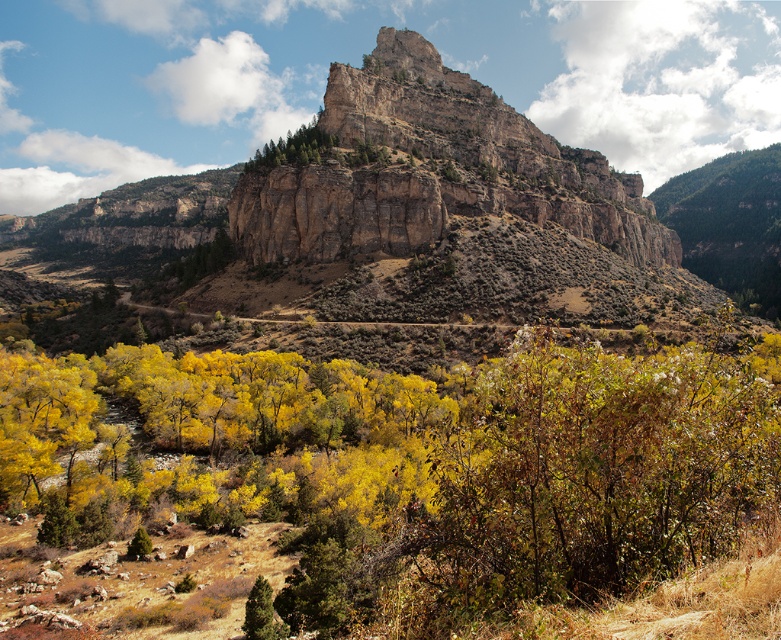
Can you confirm if yellow leafy tree at center is positioned above rugged stone mountain at center?

Incorrect, yellow leafy tree at center is not positioned above rugged stone mountain at center.

What do you see at coordinates (415, 467) in the screenshot?
I see `yellow leafy tree at center` at bounding box center [415, 467].

Which is behind, point (594, 572) or point (630, 241)?

The point (630, 241) is behind.

Locate an element on the screen. yellow leafy tree at center is located at coordinates (415, 467).

Is yellow leafy tree at center to the right of green textured pine tree at upper center from the viewer's perspective?

Yes, yellow leafy tree at center is to the right of green textured pine tree at upper center.

Is yellow leafy tree at center to the left of green textured pine tree at upper center from the viewer's perspective?

No, yellow leafy tree at center is not to the left of green textured pine tree at upper center.

Is point (241, 525) positioned after point (314, 141)?

No.

Find the location of `yellow leafy tree at center`. yellow leafy tree at center is located at coordinates (415, 467).

Between point (393, 193) and point (266, 156), which one is positioned behind?

The point (266, 156) is more distant.

Is point (266, 241) in front of point (252, 157)?

That is True.

Where is `rugged brown cliff at center`? rugged brown cliff at center is located at coordinates (333, 211).